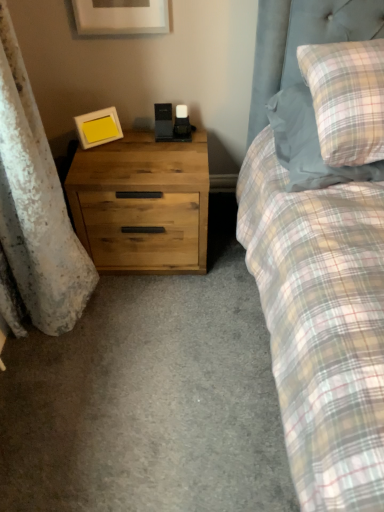
Question: From a real-world perspective, is natural wood chest of drawers at left positioned above or below matte yellow picture frame at left, the second picture frame viewed from the top?

Choices:
 (A) below
 (B) above

Answer: (A)

Question: Relative to matte yellow picture frame at left, acting as the 2th picture frame starting from the front, is natural wood chest of drawers at left in front or behind?

Choices:
 (A) behind
 (B) front

Answer: (B)

Question: Which object is positioned farthest from the matte white picture frame at upper center, the 1th picture frame positioned from the top?

Choices:
 (A) plaid fabric pillow at upper right
 (B) matte yellow picture frame at left, the second picture frame viewed from the top
 (C) natural wood chest of drawers at left

Answer: (A)

Question: Estimate the real-world distances between objects in this image. Which object is closer to the natural wood chest of drawers at left?

Choices:
 (A) matte yellow picture frame at left, which appears as the 1th picture frame when viewed from the back
 (B) plaid fabric pillow at upper right
 (C) matte white picture frame at upper center, the 2th picture frame positioned from the bottom

Answer: (A)